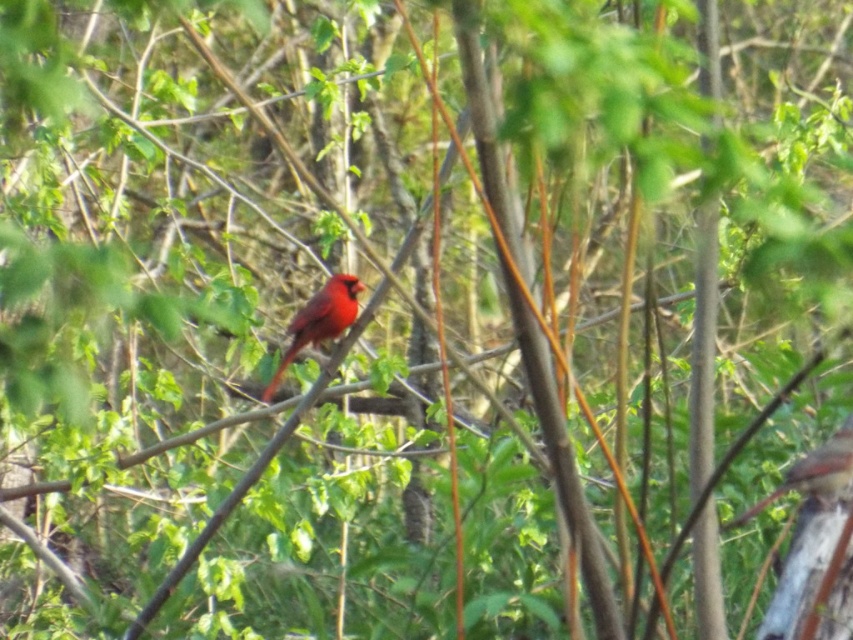
Question: Which of the following is the farthest from the observer?

Choices:
 (A) matte red bird at center
 (B) matte red cardinal at center

Answer: (B)

Question: Can you confirm if matte red cardinal at center is positioned to the right of matte red bird at center?

Choices:
 (A) no
 (B) yes

Answer: (A)

Question: Is matte red cardinal at center to the right of matte red bird at center from the viewer's perspective?

Choices:
 (A) no
 (B) yes

Answer: (A)

Question: Which point appears closest to the camera in this image?

Choices:
 (A) (824, 444)
 (B) (345, 321)

Answer: (A)

Question: Can you confirm if matte red cardinal at center is positioned to the left of matte red bird at center?

Choices:
 (A) yes
 (B) no

Answer: (A)

Question: Which object appears farthest from the camera in this image?

Choices:
 (A) matte red cardinal at center
 (B) matte red bird at center

Answer: (A)